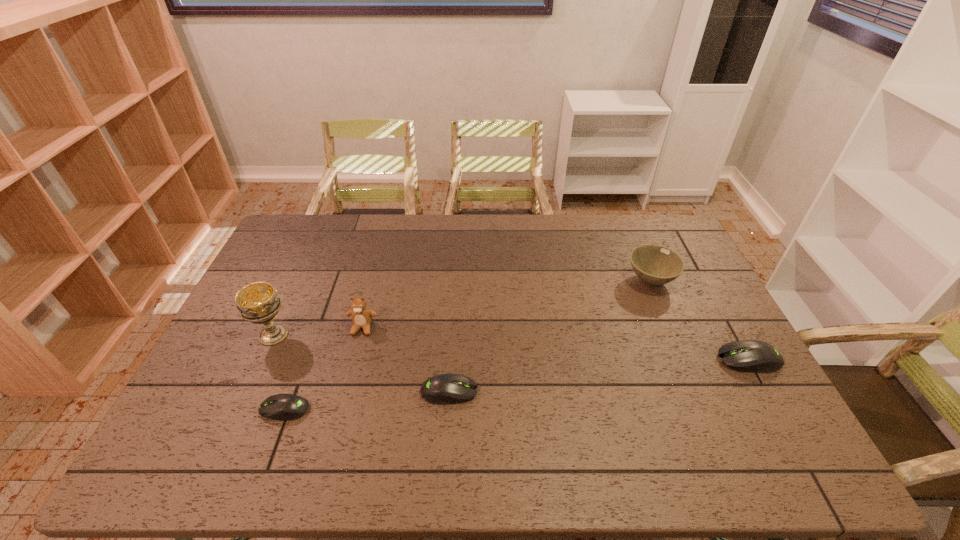
Locate an element on the screen. The image size is (960, 540). the leftmost computer mouse is located at coordinates (283, 407).

Where is `the shortest computer mouse`? The image size is (960, 540). the shortest computer mouse is located at coordinates (283, 407).

This screenshot has height=540, width=960. Identify the location of the second computer mouse from left to right. (443, 389).

Identify the location of the fourth object from left to right. (x=443, y=389).

Locate an element on the screen. The width and height of the screenshot is (960, 540). the rightmost object is located at coordinates (753, 356).

What are the coordinates of `the farthest computer mouse` in the screenshot? It's located at (753, 356).

You are a GUI agent. You are given a task and a screenshot of the screen. Output one action in this format:
    pyautogui.click(x=<x>, y=<y>)
    Task: Click on the bowl
    This screenshot has height=540, width=960.
    Given the screenshot: What is the action you would take?
    pyautogui.click(x=655, y=265)

You are a GUI agent. You are given a task and a screenshot of the screen. Output one action in this format:
    pyautogui.click(x=<x>, y=<y>)
    Task: Click on the second object from right to left
    This screenshot has height=540, width=960.
    Given the screenshot: What is the action you would take?
    pyautogui.click(x=655, y=265)

At what (x,y) coordinates should I click in order to perform the action: click on chalice. Please return your answer as a coordinate pair (x, y). The width and height of the screenshot is (960, 540). Looking at the image, I should click on (258, 302).

What are the coordinates of `the second tallest object` in the screenshot? It's located at (361, 316).